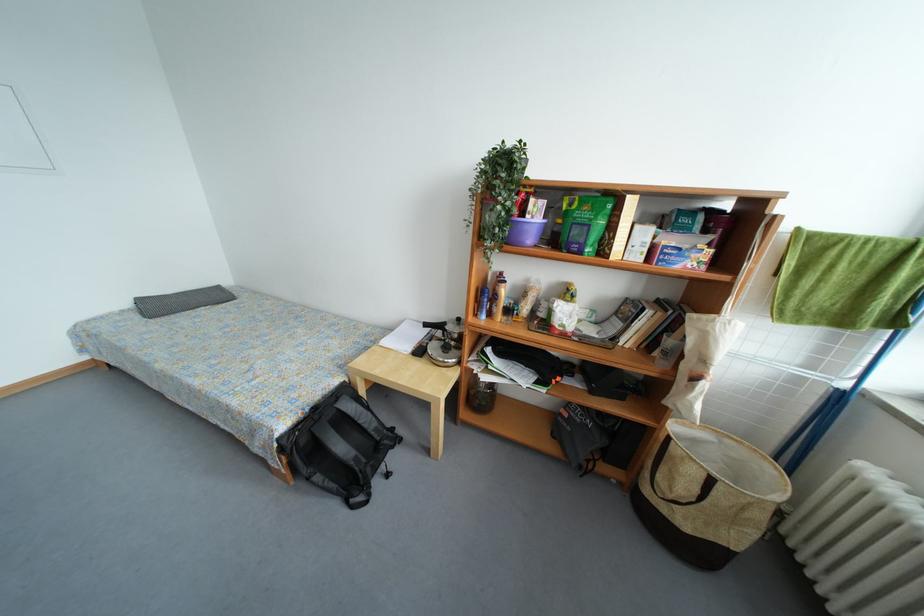
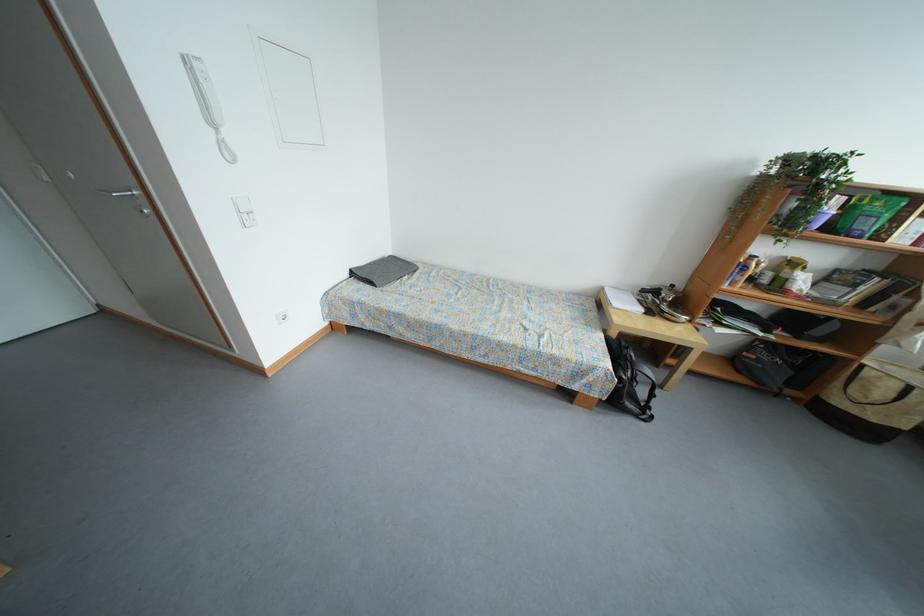
Question: The images are taken continuously from a first-person perspective. In which direction are you moving?

Choices:
 (A) Left
 (B) Right
 (C) Forward
 (D) Backward

Answer: (A)